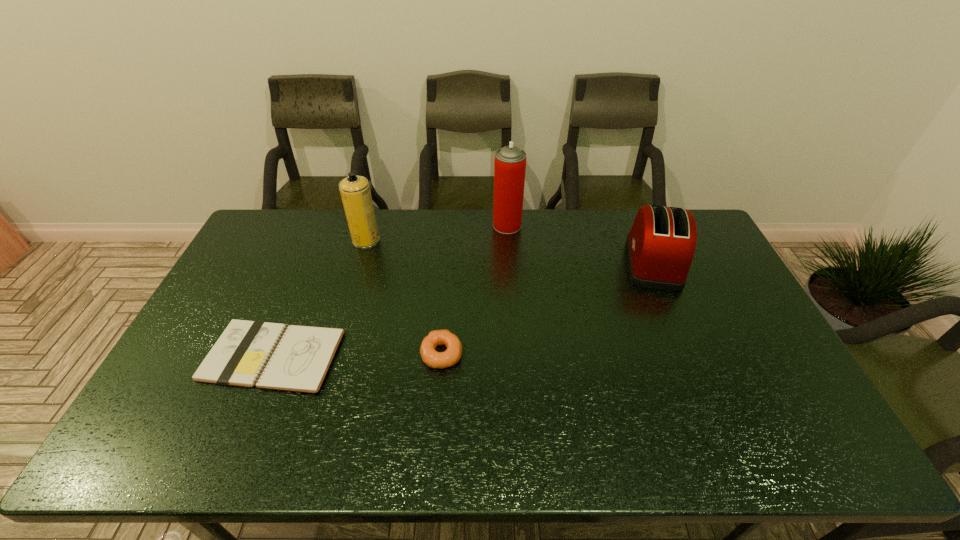
The image size is (960, 540). Identify the location of free region located 0.240m on the left of the left aerosol can. (286, 240).

At what (x,y) coordinates should I click in order to perform the action: click on free spot located on the front of the third shortest object. Please return your answer as a coordinate pair (x, y). Image resolution: width=960 pixels, height=540 pixels. Looking at the image, I should click on (676, 319).

This screenshot has height=540, width=960. Find the location of `free space located on the back of the fourth tallest object`. free space located on the back of the fourth tallest object is located at coordinates (447, 273).

At what (x,y) coordinates should I click in order to perform the action: click on vacant space located 0.330m on the right of the notepad. Please return your answer as a coordinate pair (x, y). Looking at the image, I should click on (458, 355).

The height and width of the screenshot is (540, 960). What are the coordinates of `toaster located in the far edge section of the desktop` in the screenshot? It's located at (660, 246).

Locate an element on the screen. object positioned at the left edge is located at coordinates (273, 356).

I want to click on object located in the right edge section of the desktop, so click(660, 246).

Where is `object at the far right corner`? object at the far right corner is located at coordinates (660, 246).

Where is `vacant area at the far edge`? The image size is (960, 540). vacant area at the far edge is located at coordinates (612, 233).

In the image, there is a desktop. Where is `vacant space at the near edge`? The width and height of the screenshot is (960, 540). vacant space at the near edge is located at coordinates (291, 428).